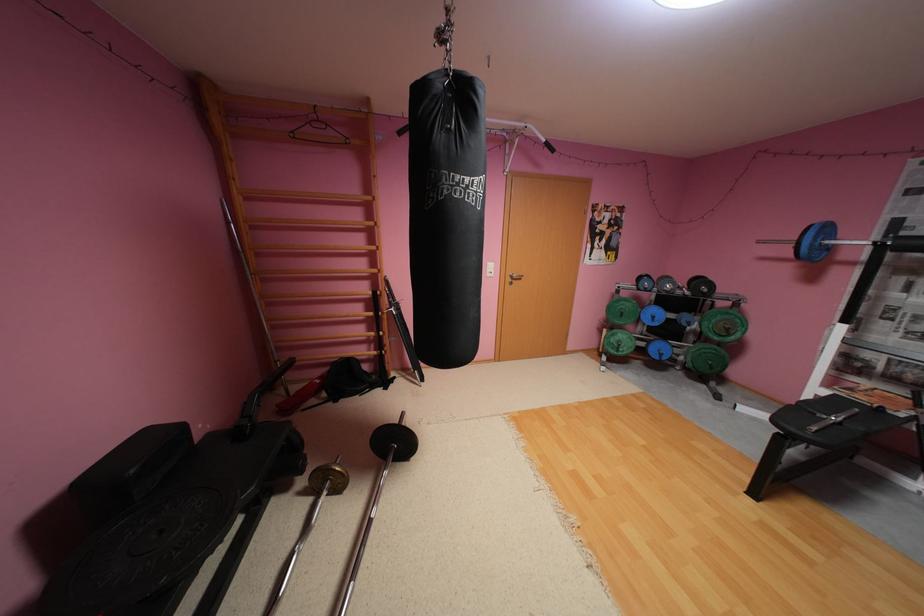
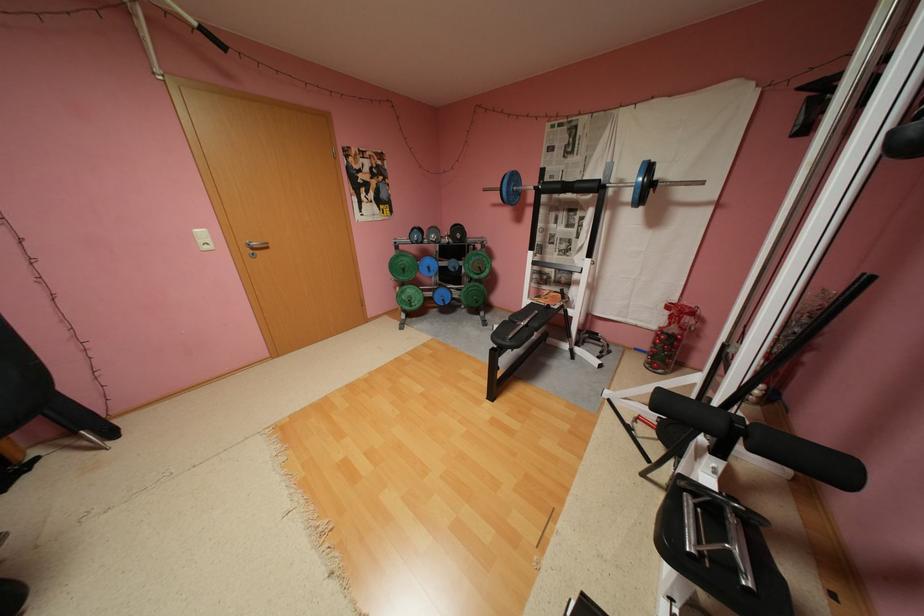
Find the pixel in the second image that matches the point at 497,270 in the first image.

(210, 241)